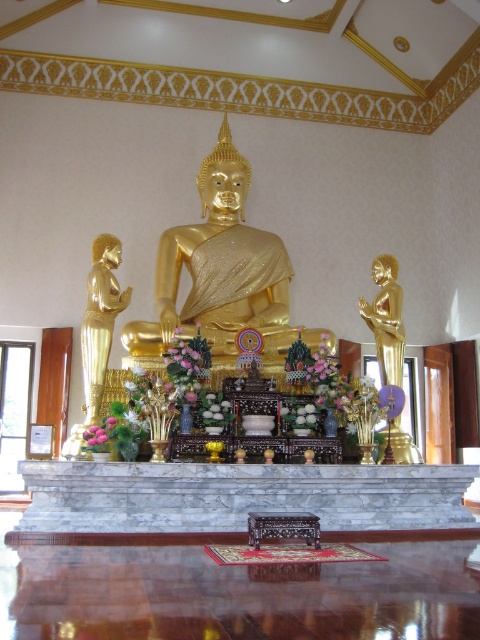
You are a temple visitor standing in front of the altar. You notice two golden statues on the altar. Which one is more to the left, the gold shiny statue at center or the gold polished statue at left?

The gold polished statue at left is more to the left because the gold shiny statue at center is positioned on the right side of it.

You are standing in front of a Buddhist altar and want to take a photo of the gold shiny statue at center. If your camera has a maximum focus range of 20 meters, will it be able to capture the statue clearly?

The gold shiny statue at center and camera are 21.20 meters apart, which exceeds the camera maximum focus range of 20 meters. Therefore, the camera cannot capture the statue clearly.